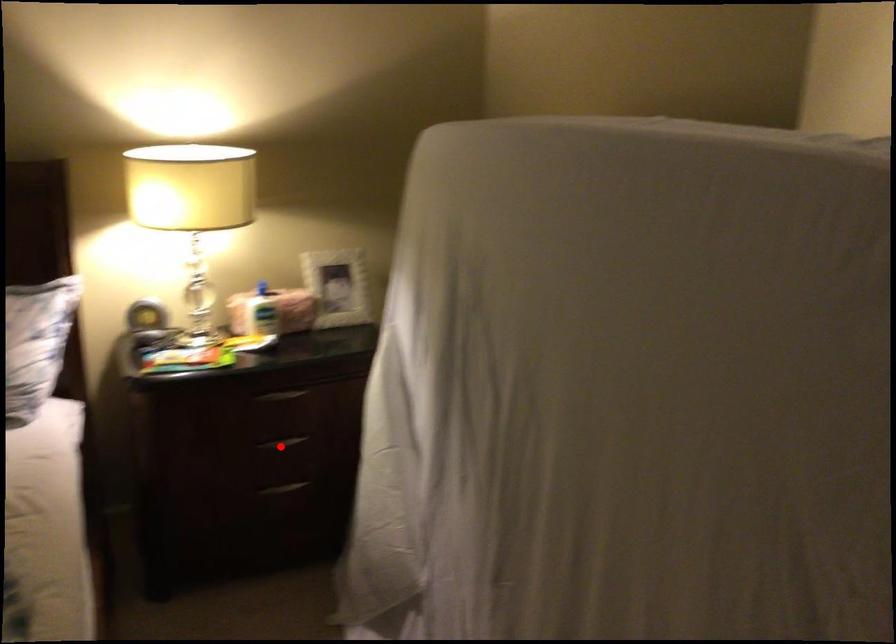
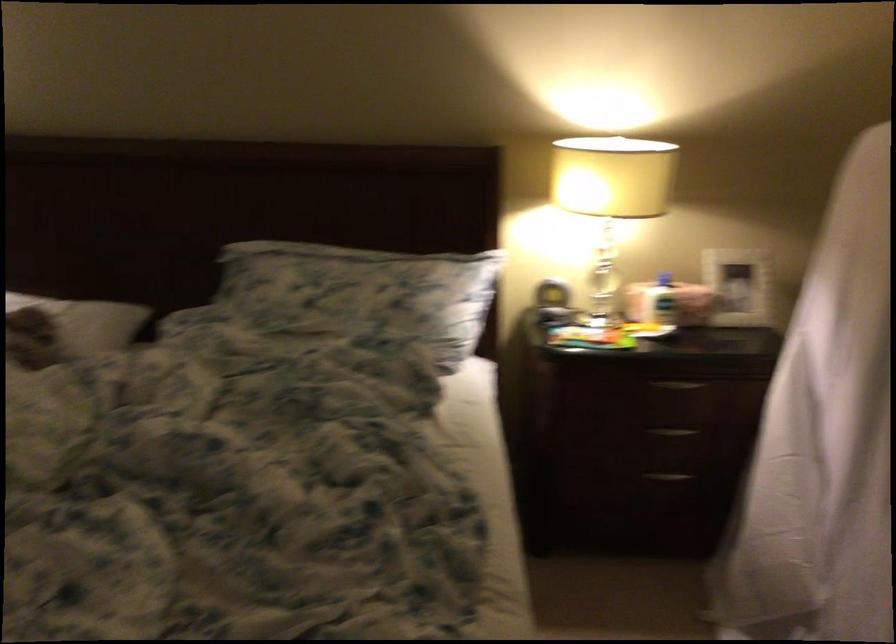
Find the pixel in the second image that matches the highlighted location in the first image.

(672, 431)